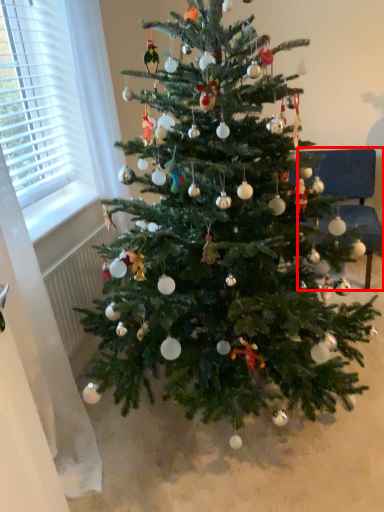
Question: From the image's perspective, what is the correct spatial relationship of armchair (annotated by the red box) in relation to christmas tree?

Choices:
 (A) above
 (B) below

Answer: (A)